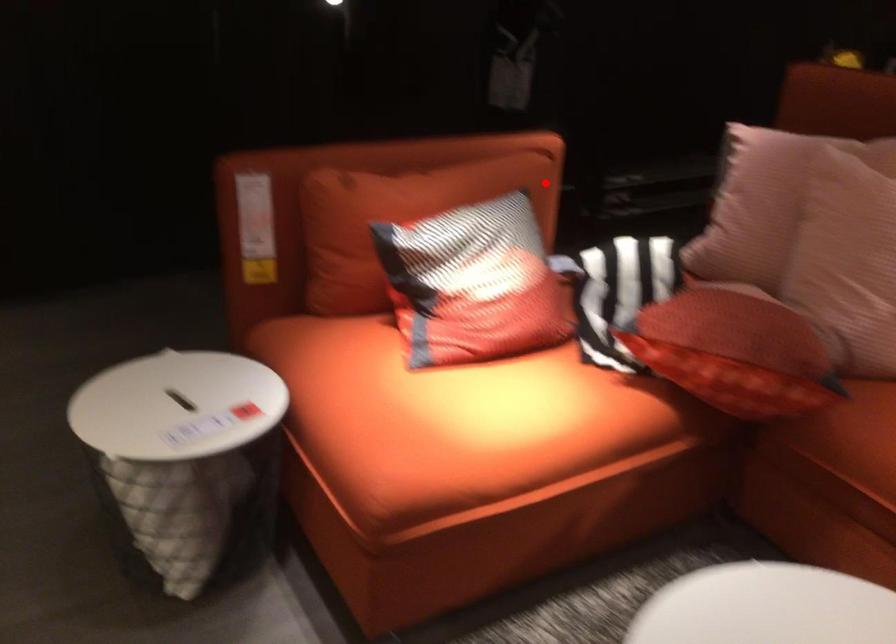
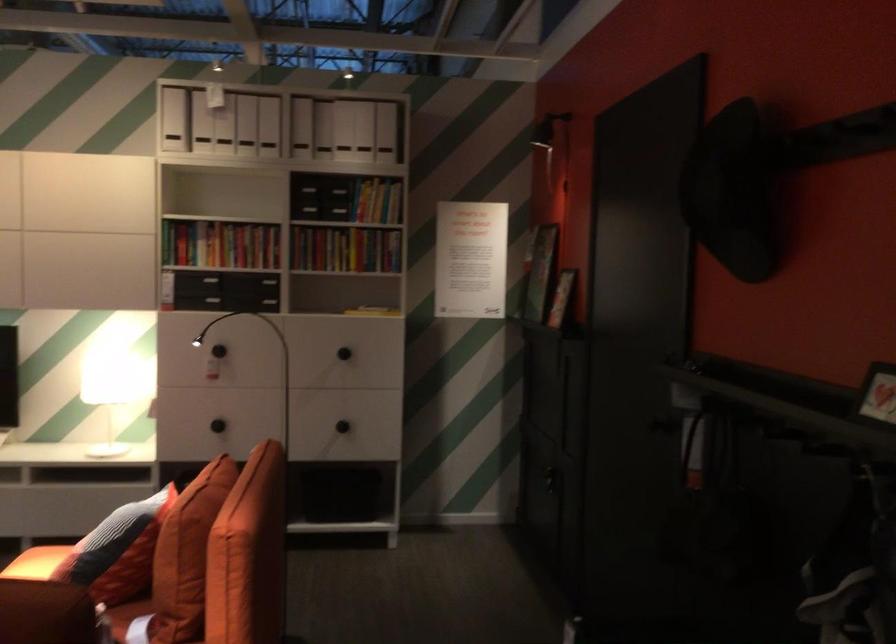
Locate, in the second image, the point that corresponds to the highlighted location in the first image.

(186, 554)